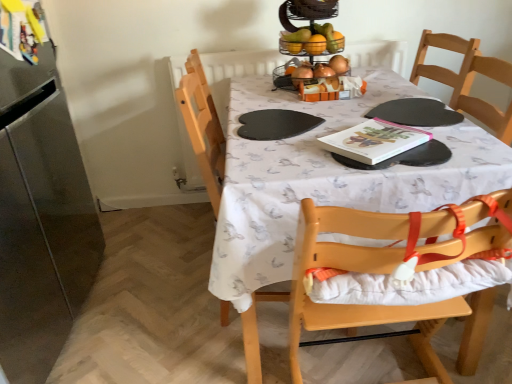
Question: Is white printed tablecloth at center bigger than shiny metallic fruit basket at upper center?

Choices:
 (A) yes
 (B) no

Answer: (A)

Question: From the image's perspective, is white printed tablecloth at center above shiny metallic fruit basket at upper center?

Choices:
 (A) no
 (B) yes

Answer: (A)

Question: Is white printed tablecloth at center shorter than shiny metallic fruit basket at upper center?

Choices:
 (A) yes
 (B) no

Answer: (B)

Question: Can you confirm if white printed tablecloth at center is smaller than shiny metallic fruit basket at upper center?

Choices:
 (A) yes
 (B) no

Answer: (B)

Question: Can you confirm if white printed tablecloth at center is taller than shiny metallic fruit basket at upper center?

Choices:
 (A) no
 (B) yes

Answer: (B)

Question: Is white printed tablecloth at center inside or outside of light wood highchair at center?

Choices:
 (A) outside
 (B) inside

Answer: (A)

Question: Is white printed tablecloth at center wider or thinner than light wood highchair at center?

Choices:
 (A) wide
 (B) thin

Answer: (A)

Question: Based on their positions, is white printed tablecloth at center located to the left or right of light wood highchair at center?

Choices:
 (A) right
 (B) left

Answer: (B)

Question: Is point (297, 102) closer or farther from the camera than point (376, 314)?

Choices:
 (A) closer
 (B) farther

Answer: (B)

Question: Based on their sizes in the image, would you say hardcover book at center is bigger or smaller than light wood highchair at center?

Choices:
 (A) big
 (B) small

Answer: (B)

Question: In the image, is hardcover book at center positioned in front of or behind light wood highchair at center?

Choices:
 (A) behind
 (B) front

Answer: (A)

Question: Is point (353, 152) positioned closer to the camera than point (292, 322)?

Choices:
 (A) closer
 (B) farther

Answer: (A)

Question: Considering the positions of hardcover book at center and light wood highchair at center in the image, is hardcover book at center taller or shorter than light wood highchair at center?

Choices:
 (A) tall
 (B) short

Answer: (B)

Question: Is light wood highchair at center to the left or to the right of stainless steel refrigerator at left in the image?

Choices:
 (A) left
 (B) right

Answer: (B)

Question: In the image, is light wood highchair at center positioned in front of or behind stainless steel refrigerator at left?

Choices:
 (A) front
 (B) behind

Answer: (A)